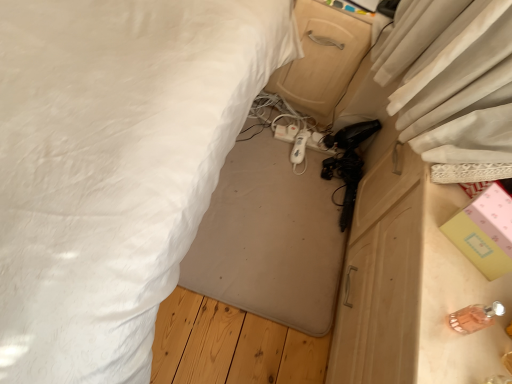
The width and height of the screenshot is (512, 384). Identify the location of empty space that is in between translucent glass perfume bottle at lower right, which is the 2th equipment in back-to-front order, and pink paper box at right. (455, 276).